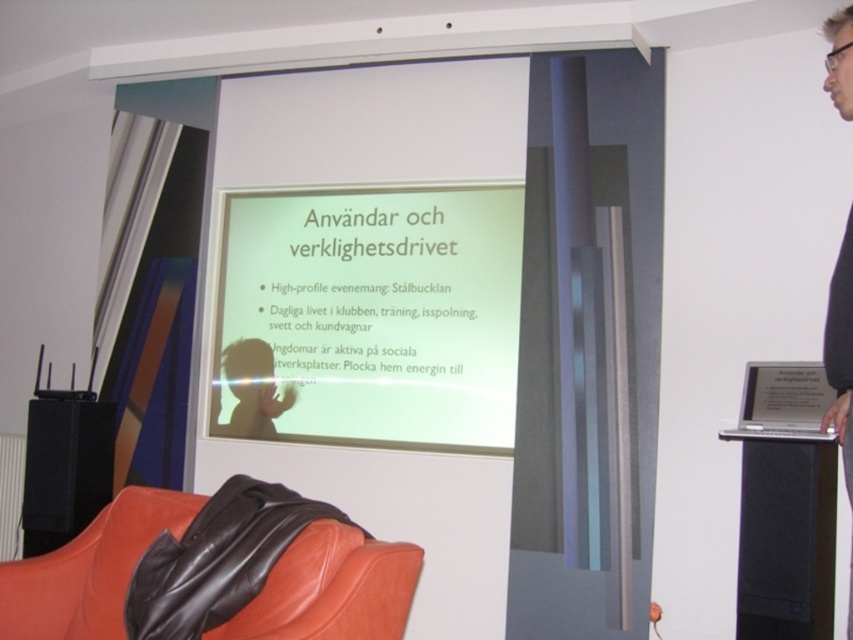
Question: Among these points, which one is nearest to the camera?

Choices:
 (A) (376, 390)
 (B) (822, 24)

Answer: (B)

Question: Which of the following is the closest to the observer?

Choices:
 (A) white matte projector screen at center
 (B) leather-like orange armchair at lower left

Answer: (B)

Question: Is leather-like orange armchair at lower left closer to the viewer compared to black fabric at upper right?

Choices:
 (A) no
 (B) yes

Answer: (A)

Question: Does leather-like orange armchair at lower left appear on the right side of black fabric at upper right?

Choices:
 (A) yes
 (B) no

Answer: (B)

Question: Does leather-like orange armchair at lower left have a smaller size compared to black fabric at upper right?

Choices:
 (A) no
 (B) yes

Answer: (B)

Question: Which point is farther to the camera?

Choices:
 (A) white matte projector screen at center
 (B) black fabric at upper right
 (C) leather-like orange armchair at lower left

Answer: (A)